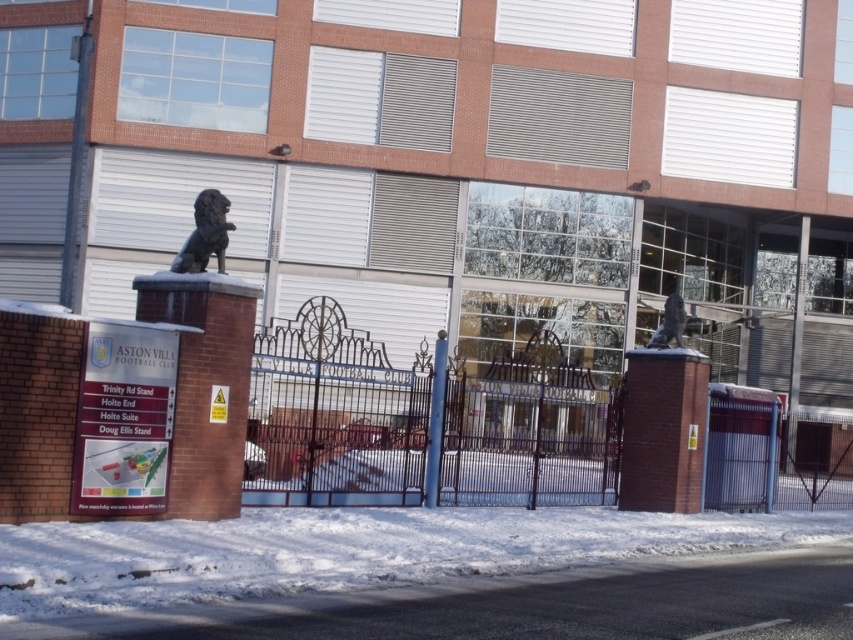
Question: Which of the following is the farthest from the observer?

Choices:
 (A) (x=389, y=579)
 (B) (x=281, y=356)
 (C) (x=223, y=252)

Answer: (B)

Question: Is white powdery snow at lower left positioned in front of blue metallic pole at center?

Choices:
 (A) no
 (B) yes

Answer: (B)

Question: In this image, where is white powdery snow at lower left located relative to black polished stone lion at upper center?

Choices:
 (A) left
 (B) right

Answer: (B)

Question: Where is white powdery snow at lower left located in relation to black polished stone lion at upper center in the image?

Choices:
 (A) right
 (B) left

Answer: (A)

Question: Considering the real-world distances, which object is farthest from the white powdery snow at lower left?

Choices:
 (A) blue metallic pole at center
 (B) black polished stone lion at upper center
 (C) black wrought iron fence at center

Answer: (B)

Question: Among these points, which one is nearest to the camera?

Choices:
 (A) (181, 246)
 (B) (247, 520)

Answer: (B)